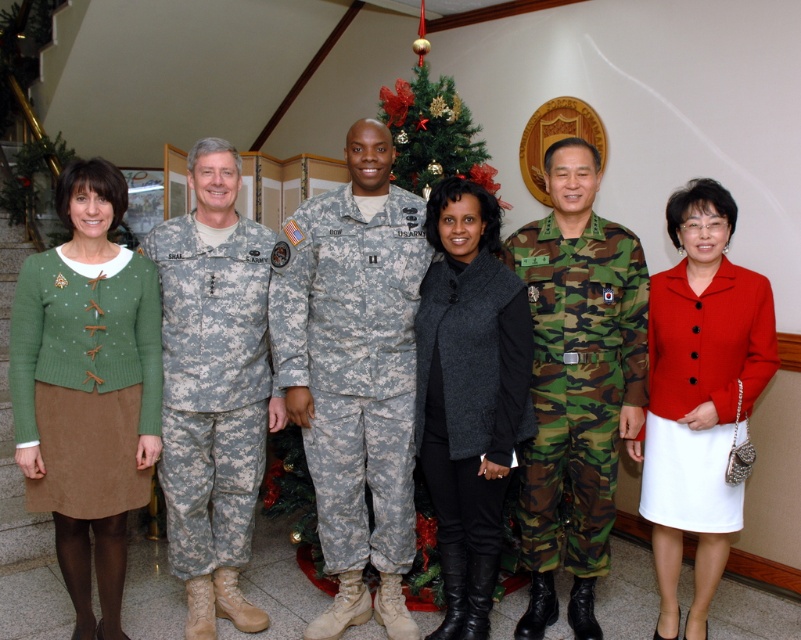
Question: Which object is the farthest from the camo uniform at center?

Choices:
 (A) charcoal woolen vest at center
 (B) matte red blazer at center
 (C) camouflage uniform at center
 (D) green corduroy skirt at center

Answer: (D)

Question: Can you confirm if camouflage uniform at center is positioned below camo uniform at center?

Choices:
 (A) no
 (B) yes

Answer: (A)

Question: Considering the relative positions of green corduroy skirt at center and camo uniform at center in the image provided, where is green corduroy skirt at center located with respect to camo uniform at center?

Choices:
 (A) above
 (B) below

Answer: (B)

Question: Which is nearer to the green corduroy skirt at center?

Choices:
 (A) camouflage uniform at center
 (B) matte red blazer at center

Answer: (A)

Question: Is charcoal woolen vest at center above camouflage fabric uniform at center?

Choices:
 (A) yes
 (B) no

Answer: (B)

Question: Which of the following is the farthest from the observer?

Choices:
 (A) (604, 282)
 (B) (204, 394)
 (C) (769, 348)
 (D) (308, 276)

Answer: (D)